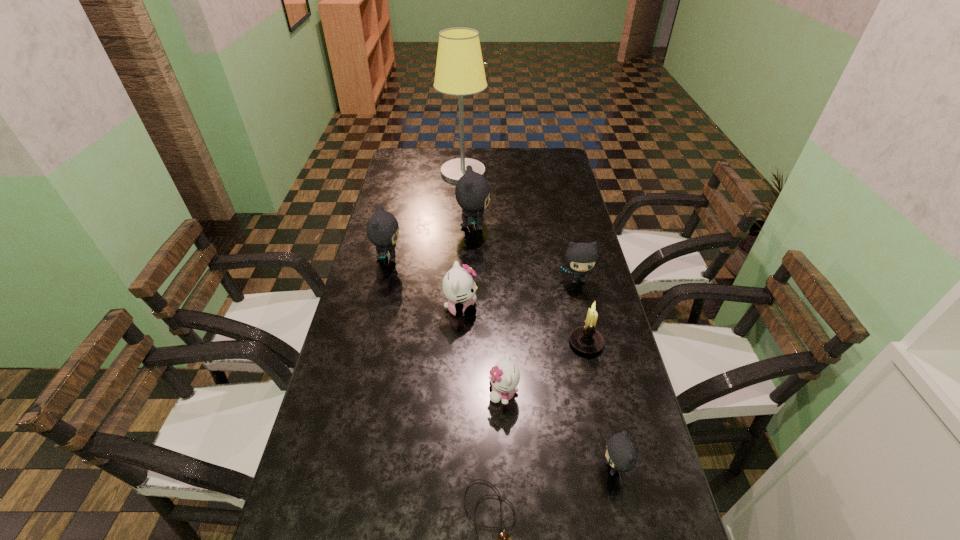
I want to click on table lamp, so click(x=459, y=71).

What are the coordinates of `the tallest object` in the screenshot? It's located at (459, 71).

The width and height of the screenshot is (960, 540). I want to click on the tallest kitten, so click(x=472, y=191).

This screenshot has width=960, height=540. I want to click on the second tallest object, so click(472, 191).

Where is `the leftmost kitten`? This screenshot has height=540, width=960. the leftmost kitten is located at coordinates (382, 228).

At what (x,y) coordinates should I click in order to perform the action: click on the third smallest gray kitten. Please return your answer as a coordinate pair (x, y). The height and width of the screenshot is (540, 960). Looking at the image, I should click on tap(382, 228).

Find the location of `the fifth nearest object`. the fifth nearest object is located at coordinates (459, 287).

This screenshot has height=540, width=960. What are the coordinates of `the left white kitten` in the screenshot? It's located at (459, 287).

Image resolution: width=960 pixels, height=540 pixels. I want to click on white candle holder, so click(586, 339).

This screenshot has height=540, width=960. What are the coordinates of `candle holder` in the screenshot? It's located at (586, 339).